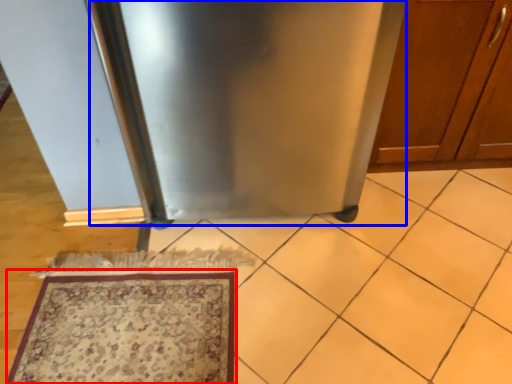
Question: Which object appears closest to the camera in this image, mat (highlighted by a red box) or appliance (highlighted by a blue box)?

Choices:
 (A) mat
 (B) appliance

Answer: (B)